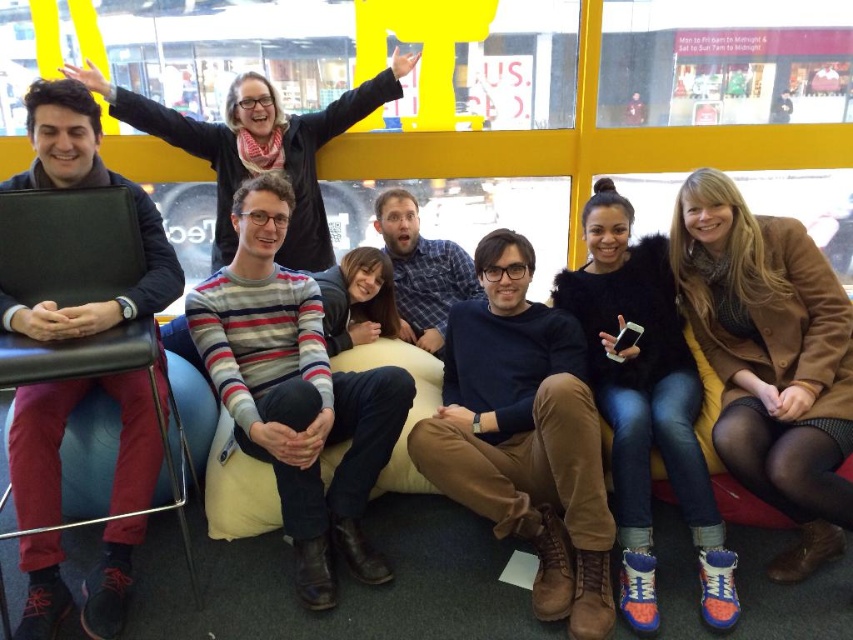
Question: Based on their relative distances, which object is farther from the matte black laptop at left?

Choices:
 (A) dark blue sweater at center
 (B) striped sweater at center
 (C) denim jeans at lower right
 (D) black leather chair at left

Answer: (C)

Question: Based on their relative distances, which object is nearer to the matte blue shirt at center?

Choices:
 (A) dark blue sweater at center
 (B) black leather chair at left
 (C) denim jeans at lower right
 (D) matte black laptop at left

Answer: (D)

Question: Does dark blue sweater at center appear under matte blue shirt at center?

Choices:
 (A) yes
 (B) no

Answer: (A)

Question: Is black leather chair at left positioned behind striped sweater at center?

Choices:
 (A) no
 (B) yes

Answer: (A)

Question: Does black leather chair at left appear on the right side of striped sweater at center?

Choices:
 (A) no
 (B) yes

Answer: (A)

Question: Based on their relative distances, which object is farther from the striped sweater at center?

Choices:
 (A) brown leather jacket at upper right
 (B) matte blue shirt at center

Answer: (A)